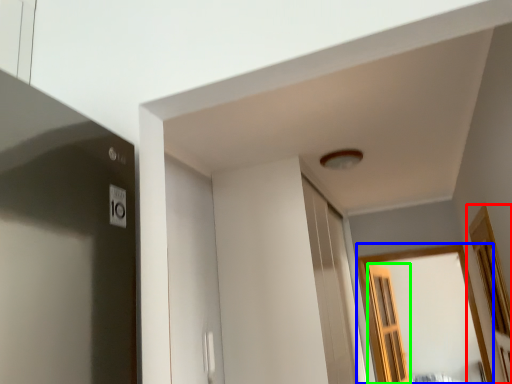
Question: Based on their relative distances, which object is farther from window (highlighted by a red box)? Choose from window (highlighted by a blue box) and screen door (highlighted by a green box).

Choices:
 (A) window
 (B) screen door

Answer: (B)